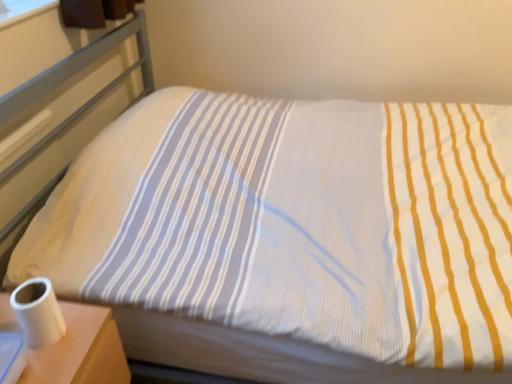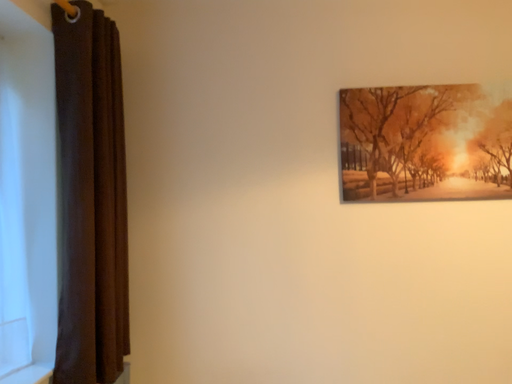
Question: How did the camera likely rotate when shooting the video?

Choices:
 (A) rotated upward
 (B) rotated downward

Answer: (A)